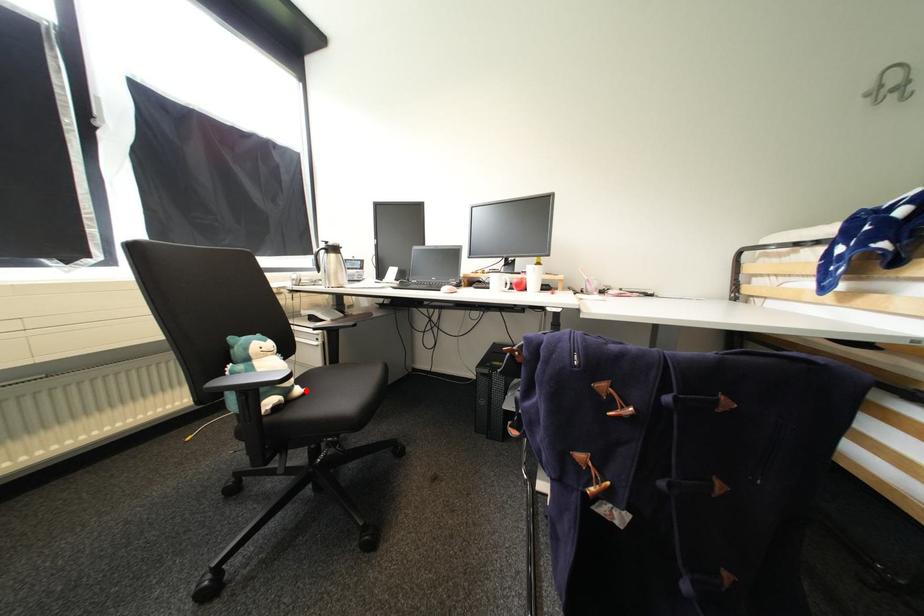
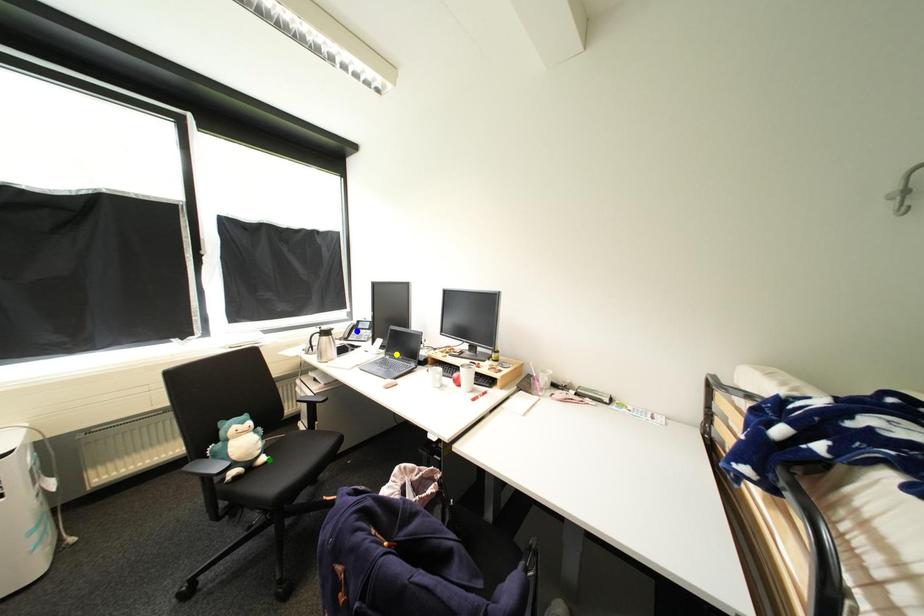
Question: I am providing you with two images of the same scene from different viewpoints. A red point is marked on the first image. You are given multiple points on the second image. Can you choose the point in image 2 that corresponds to the point in image 1?

Choices:
 (A) green point
 (B) yellow point
 (C) blue point

Answer: (A)